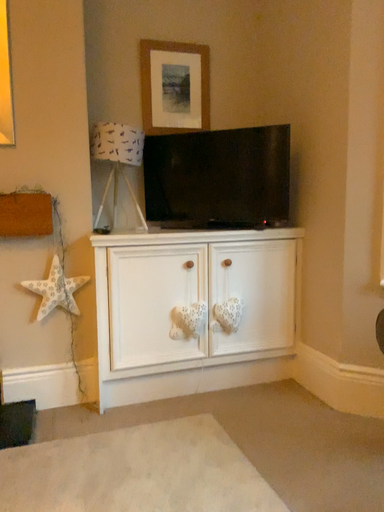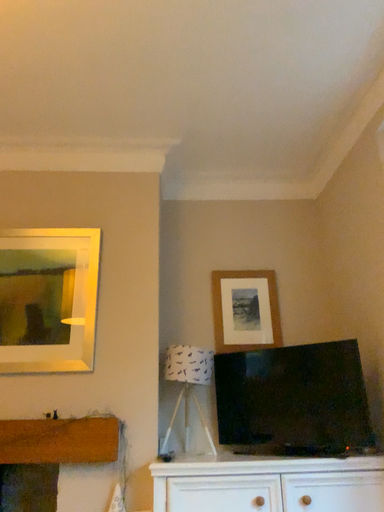
Question: Which way did the camera rotate in the video?

Choices:
 (A) rotated upward
 (B) rotated downward

Answer: (A)